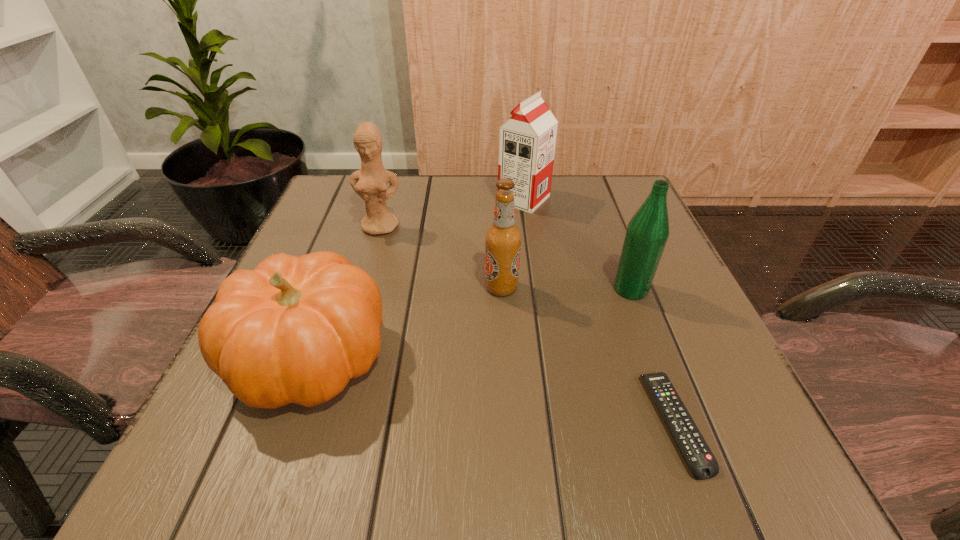
Locate an element on the screen. vacant space located on the front label of the beer bottle is located at coordinates [344, 288].

Find the location of a particular element. The image size is (960, 540). vacant space situated 0.120m on the front label of the beer bottle is located at coordinates (420, 288).

Where is `vacant space situated on the front of the pumpkin`? The image size is (960, 540). vacant space situated on the front of the pumpkin is located at coordinates (263, 488).

Find the location of `blank area located 0.350m on the back of the shortest object`. blank area located 0.350m on the back of the shortest object is located at coordinates (607, 238).

At what (x,y) coordinates should I click in order to perform the action: click on soya milk that is at the far edge. Please return your answer as a coordinate pair (x, y). Image resolution: width=960 pixels, height=540 pixels. Looking at the image, I should click on (527, 140).

In order to click on figurine present at the far edge in this screenshot , I will do `click(370, 182)`.

I want to click on pumpkin located at the near edge, so click(295, 329).

Where is `remote control that is at the near edge`? remote control that is at the near edge is located at coordinates (702, 463).

In order to click on figurine located in the left edge section of the desktop in this screenshot , I will do `click(370, 182)`.

You are a GUI agent. You are given a task and a screenshot of the screen. Output one action in this format:
    pyautogui.click(x=<x>, y=<y>)
    Task: Click on the pumpkin present at the left edge
    The width and height of the screenshot is (960, 540).
    Given the screenshot: What is the action you would take?
    pyautogui.click(x=295, y=329)